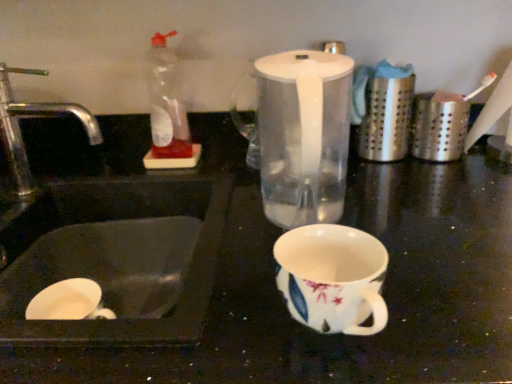
You are a GUI agent. You are given a task and a screenshot of the screen. Output one action in this format:
    pyautogui.click(x=<x>, y=<y>)
    Task: Click on the free space in front of transparent plastic blender at center
    The height and width of the screenshot is (384, 512).
    Given the screenshot: What is the action you would take?
    pyautogui.click(x=385, y=278)